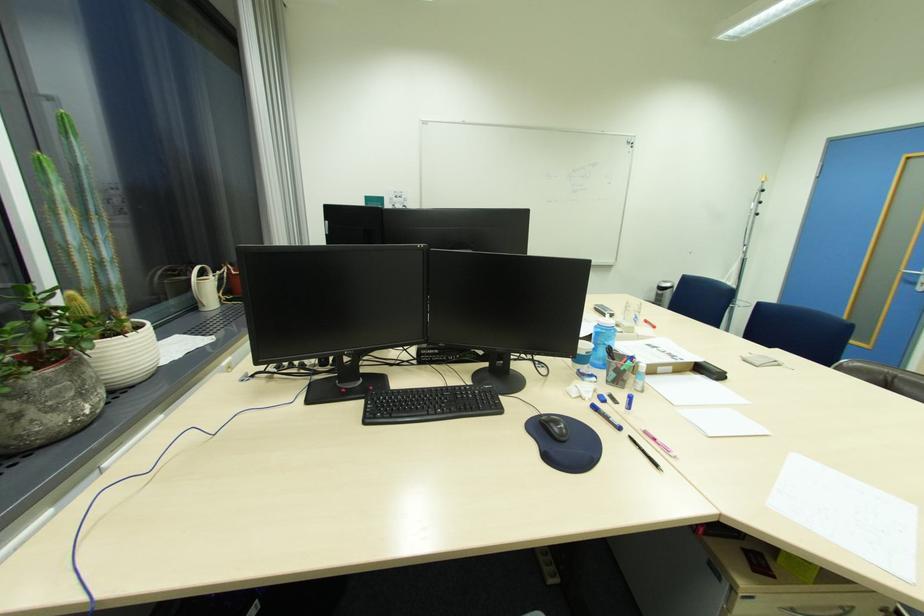
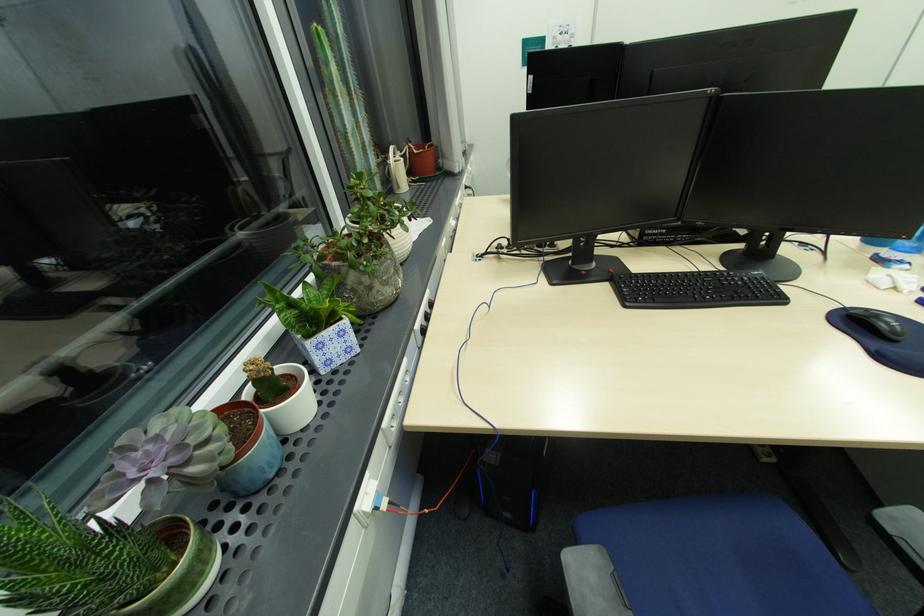
The point at [550,419] is marked in the first image. Where is the corresponding point in the second image?

(857, 312)